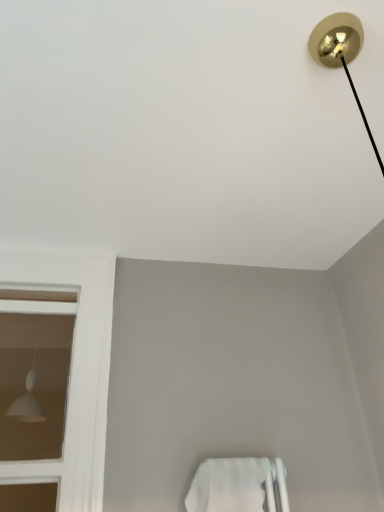
Question: From the image's perspective, is white matte towel bar at lower center located above or below white matte lampshade at left?

Choices:
 (A) above
 (B) below

Answer: (B)

Question: Based on their positions, is white matte towel bar at lower center located to the left or right of white matte lampshade at left?

Choices:
 (A) left
 (B) right

Answer: (B)

Question: Would you say white matte towel bar at lower center is inside or outside white matte lampshade at left?

Choices:
 (A) outside
 (B) inside

Answer: (A)

Question: Is point (99, 324) positioned closer to the camera than point (200, 486)?

Choices:
 (A) closer
 (B) farther

Answer: (B)

Question: Based on their positions, is white matte lampshade at left located to the left or right of white matte towel bar at lower center?

Choices:
 (A) left
 (B) right

Answer: (A)

Question: Is white matte lampshade at left wider or thinner than white matte towel bar at lower center?

Choices:
 (A) wide
 (B) thin

Answer: (B)

Question: Considering the positions of white matte lampshade at left and white matte towel bar at lower center in the image, is white matte lampshade at left taller or shorter than white matte towel bar at lower center?

Choices:
 (A) tall
 (B) short

Answer: (A)